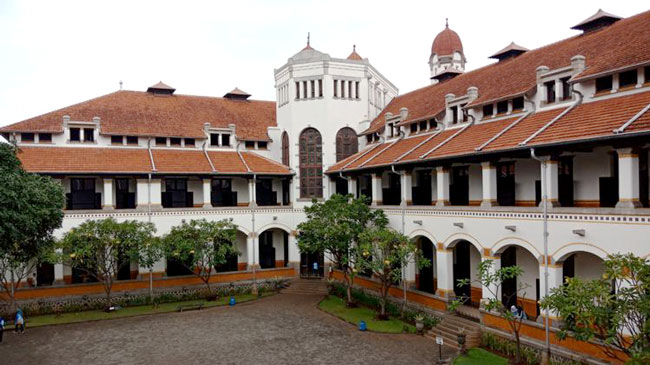
What are the coordinates of `lights` in the screenshot? It's located at [359, 327].